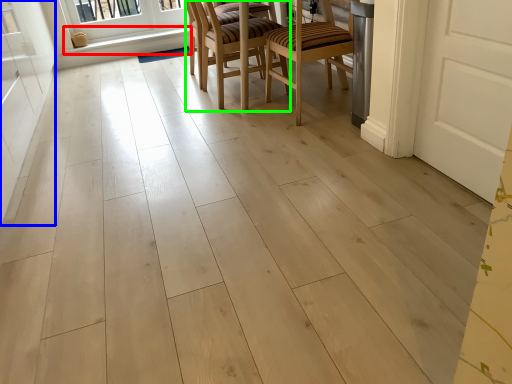
Question: Which object is positioned farthest from window sill (highlighted by a red box)? Select from screen door (highlighted by a blue box) and chair (highlighted by a green box).

Choices:
 (A) screen door
 (B) chair

Answer: (B)